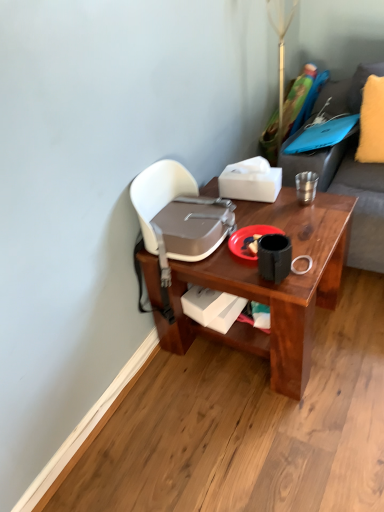
Where is `vacant area in front of brown wood desk at center`? This screenshot has height=512, width=384. vacant area in front of brown wood desk at center is located at coordinates (264, 433).